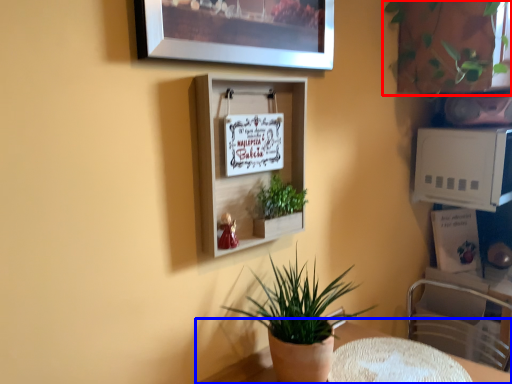
Question: Which object appears farthest to the camera in this image, houseplant (highlighted by a red box) or table (highlighted by a blue box)?

Choices:
 (A) houseplant
 (B) table

Answer: (A)